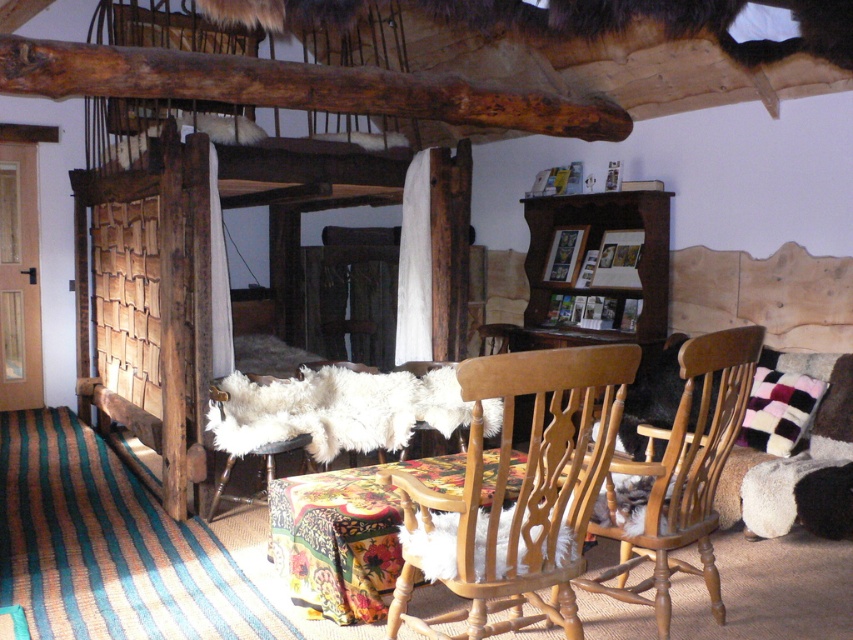
Can you confirm if wooden chair at center is thinner than floral fabric-covered table at center?

Yes, wooden chair at center is thinner than floral fabric-covered table at center.

Between wooden chair at center and floral fabric-covered table at center, which one appears on the right side from the viewer's perspective?

wooden chair at center

Between point (706, 552) and point (389, 579), which one is positioned behind?

Positioned behind is point (389, 579).

You are a GUI agent. You are given a task and a screenshot of the screen. Output one action in this format:
    pyautogui.click(x=<x>, y=<y>)
    Task: Click on the wooden chair at center
    
    Given the screenshot: What is the action you would take?
    pyautogui.click(x=683, y=474)

Based on the photo, who is shorter, light brown wood chair at center or floral fabric-covered table at center?

With less height is floral fabric-covered table at center.

Does light brown wood chair at center lie in front of floral fabric-covered table at center?

Yes, light brown wood chair at center is closer to the viewer.

Which is in front, point (514, 372) or point (375, 609)?

Point (514, 372) is more forward.

I want to click on light brown wood chair at center, so click(518, 492).

Can you confirm if light brown wood chair at center is smaller than wooden chair at center?

No, light brown wood chair at center is not smaller than wooden chair at center.

Can you confirm if light brown wood chair at center is positioned above wooden chair at center?

Incorrect, light brown wood chair at center is not positioned above wooden chair at center.

Who is more distant from viewer, (445, 550) or (701, 552)?

The point (701, 552) is more distant.

Find the location of a particular element. Image resolution: width=853 pixels, height=640 pixels. light brown wood chair at center is located at coordinates (518, 492).